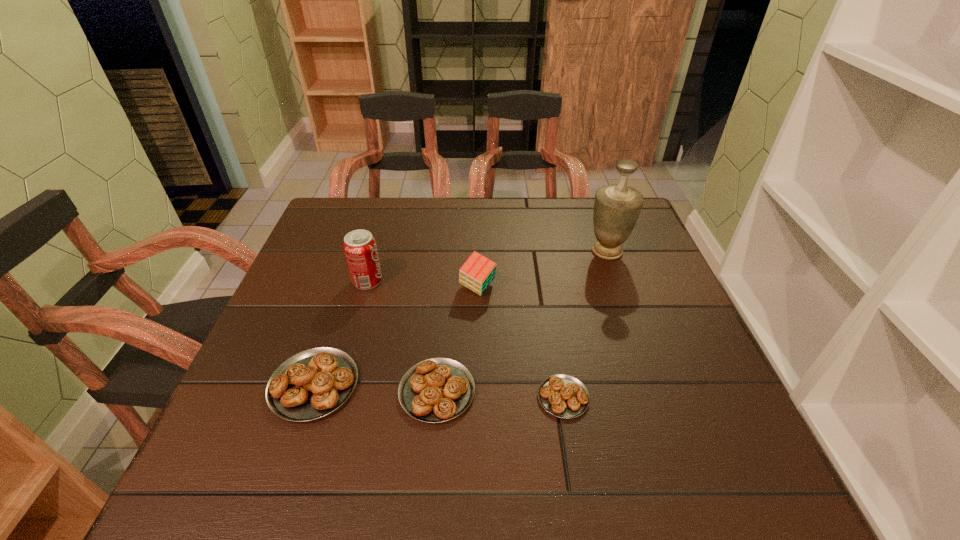
Find the location of `vacant space that satisfies the following two spatial constraints: 1. on the front side of the rightmost pastry; 2. on the left side of the leftmost pastry`. vacant space that satisfies the following two spatial constraints: 1. on the front side of the rightmost pastry; 2. on the left side of the leftmost pastry is located at coordinates (310, 397).